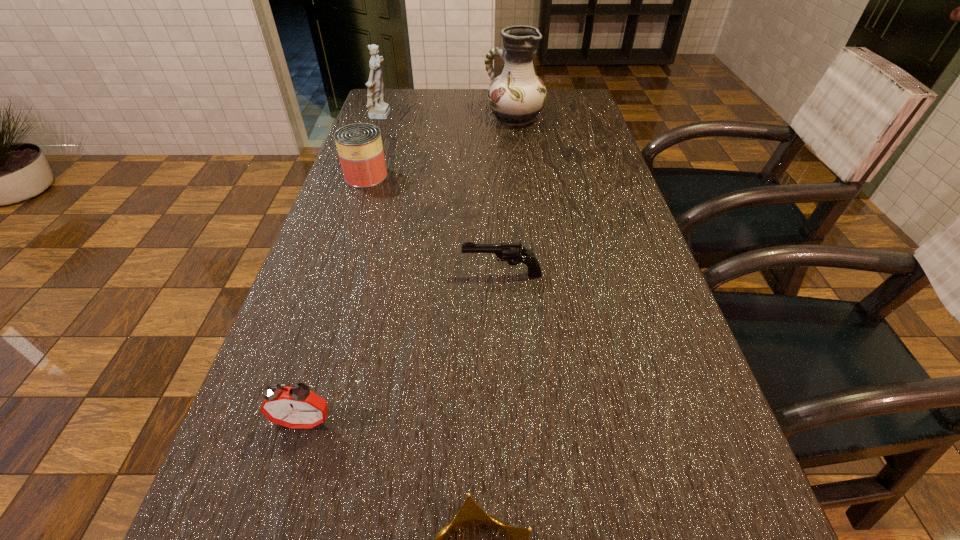
Locate an element on the screen. free spot at the right edge of the desktop is located at coordinates (686, 480).

Image resolution: width=960 pixels, height=540 pixels. In the image, there is a desktop. In order to click on free space at the far left corner in this screenshot , I will do `click(415, 91)`.

Where is `blank space at the far right corner of the desktop`? This screenshot has width=960, height=540. blank space at the far right corner of the desktop is located at coordinates (584, 92).

The image size is (960, 540). I want to click on blank region between the third nearest object and the fifth shortest object, so click(443, 195).

Where is `unoccupied position between the vase and the figurine`? This screenshot has height=540, width=960. unoccupied position between the vase and the figurine is located at coordinates (448, 117).

Identify the location of vacant space that's between the figurine and the fourth farthest object. (443, 195).

You are a GUI agent. You are given a task and a screenshot of the screen. Output one action in this format:
    pyautogui.click(x=<x>, y=<y>)
    Task: Click on the object that can be found as the second closest to the fourth nearest object
    The width and height of the screenshot is (960, 540).
    Given the screenshot: What is the action you would take?
    pyautogui.click(x=516, y=96)

Identify which object is located as the fifth nearest to the fourth nearest object. Please provide its 2D coordinates. Your answer should be formatted as a tuple, i.e. [(x, y)], where the tuple contains the x and y coordinates of a point satisfying the conditions above.

[(470, 514)]

Locate an element on the screen. The width and height of the screenshot is (960, 540). vacant space that satisfies the following two spatial constraints: 1. on the back side of the vase; 2. on the right side of the can is located at coordinates 385,118.

The height and width of the screenshot is (540, 960). Find the location of `vacant space that satisfies the following two spatial constraints: 1. on the back side of the vase; 2. on the front-facing side of the figurine`. vacant space that satisfies the following two spatial constraints: 1. on the back side of the vase; 2. on the front-facing side of the figurine is located at coordinates (515, 117).